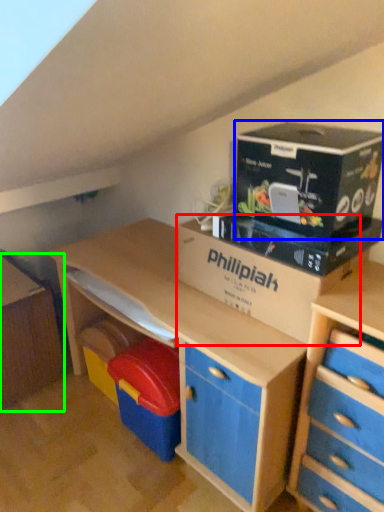
Question: Which object is the farthest from cardboard box (highlighted by a red box)? Choose among these: cardboard (highlighted by a blue box) or file cabinet (highlighted by a green box).

Choices:
 (A) cardboard
 (B) file cabinet

Answer: (B)